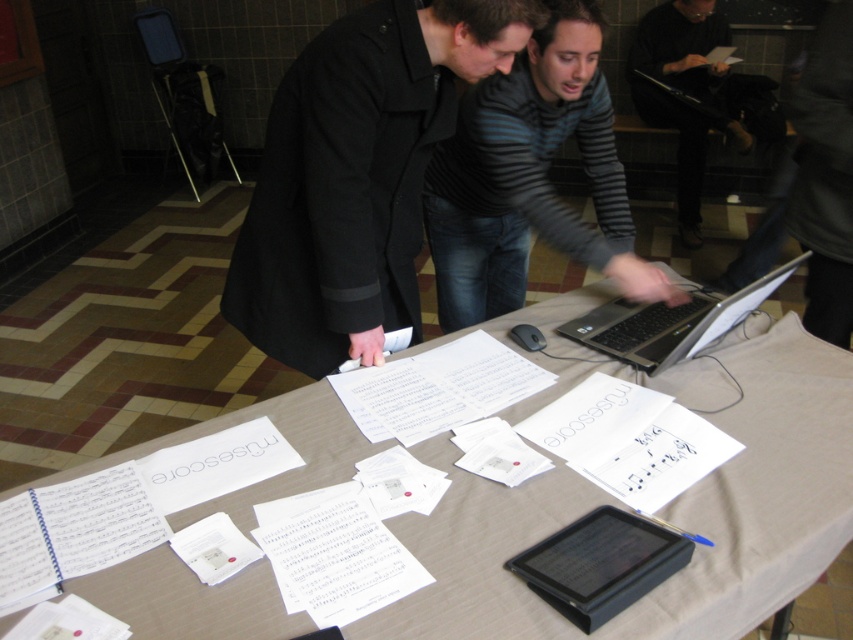
Between black matte coat at center and silver/black plastic laptop at center, which one has more height?

black matte coat at center

Is black matte coat at center wider than silver/black plastic laptop at center?

Yes, black matte coat at center is wider than silver/black plastic laptop at center.

Does point (351, 204) come behind point (619, 298)?

No, it is not.

I want to click on black matte coat at center, so click(357, 176).

Which of these two, dark gray sweater at upper right or silver/black plastic laptop at center, stands shorter?

silver/black plastic laptop at center is shorter.

The height and width of the screenshot is (640, 853). What do you see at coordinates (695, 93) in the screenshot?
I see `dark gray sweater at upper right` at bounding box center [695, 93].

I want to click on dark gray sweater at upper right, so click(x=695, y=93).

In the scene shown: Does white paper at center have a lesser width compared to silver/black plastic laptop at center?

In fact, white paper at center might be wider than silver/black plastic laptop at center.

Is white paper at center further to camera compared to silver/black plastic laptop at center?

No, it is in front of silver/black plastic laptop at center.

Locate an element on the screen. The width and height of the screenshot is (853, 640). white paper at center is located at coordinates (757, 481).